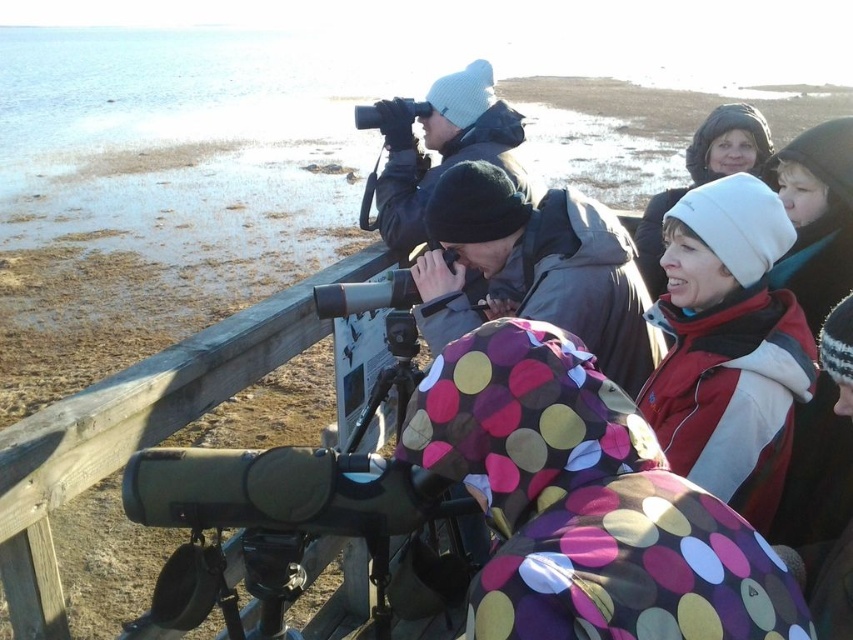
Question: Can you confirm if matte black binoculars at upper center is positioned to the left of white knit hat at upper right?

Choices:
 (A) no
 (B) yes

Answer: (B)

Question: Among these objects, which one is farthest from the camera?

Choices:
 (A) white fleece jacket at upper right
 (B) matte black binoculars at upper center
 (C) polka dot coat at center
 (D) white fleece hat at upper center

Answer: (D)

Question: Can you confirm if white fleece jacket at upper right is positioned to the left of polka dot coat at center?

Choices:
 (A) no
 (B) yes

Answer: (A)

Question: Which is nearer to the polka dot coat at center?

Choices:
 (A) white fleece jacket at upper right
 (B) matte black binoculars at upper center
 (C) white fleece hat at upper center
 (D) white knit hat at upper right

Answer: (A)

Question: Is white fleece jacket at upper right further to camera compared to polka dot coat at center?

Choices:
 (A) no
 (B) yes

Answer: (A)

Question: Among these points, which one is nearest to the camera?

Choices:
 (A) (846, 273)
 (B) (407, 230)
 (C) (432, 406)
 (D) (607, 342)

Answer: (C)